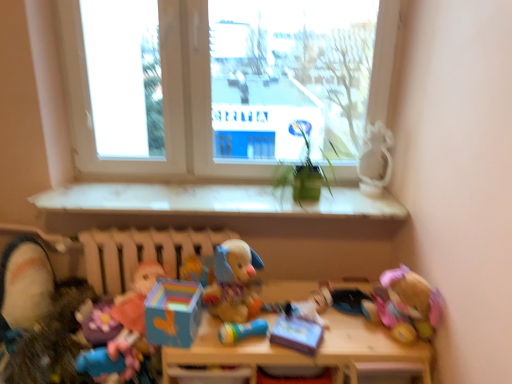
Find the location of a particular element. This screenshot has width=512, height=384. free space above wooden table at center (from a real-world perspective) is located at coordinates (294, 311).